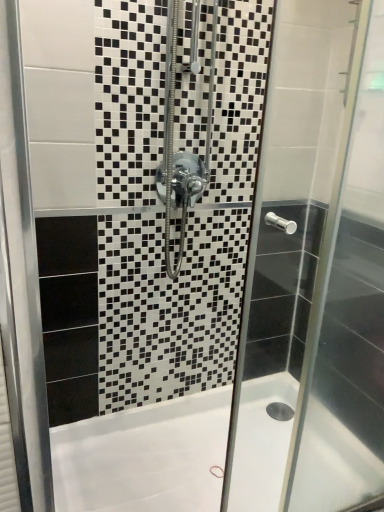
You are a GUI agent. You are given a task and a screenshot of the screen. Output one action in this format:
    pyautogui.click(x=<x>, y=<y>)
    Task: Click on the white glossy bathtub at lower center
    
    Given the screenshot: What is the action you would take?
    click(x=144, y=457)

Image resolution: width=384 pixels, height=512 pixels. What do you see at coordinates (144, 457) in the screenshot?
I see `white glossy bathtub at lower center` at bounding box center [144, 457].

I want to click on white glossy bathtub at lower center, so click(144, 457).